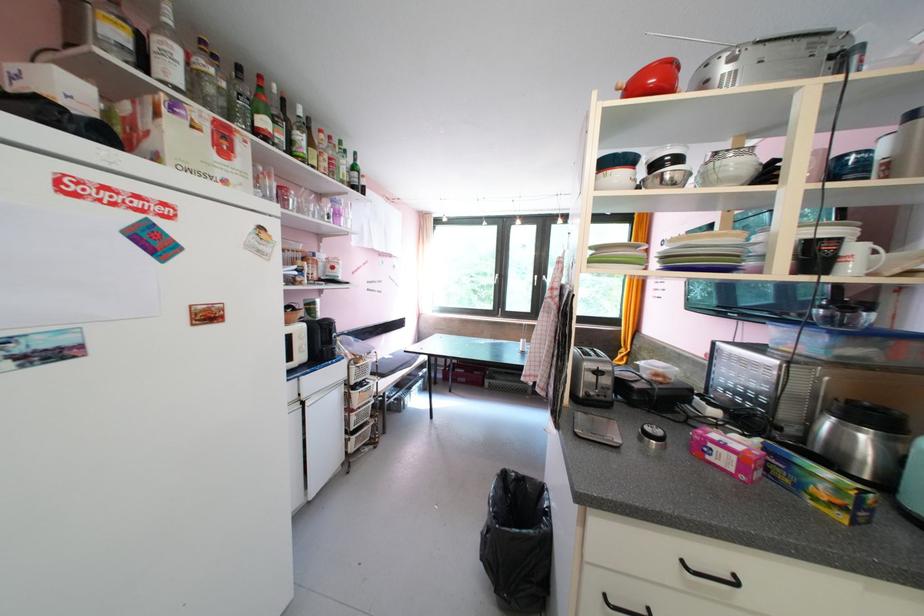
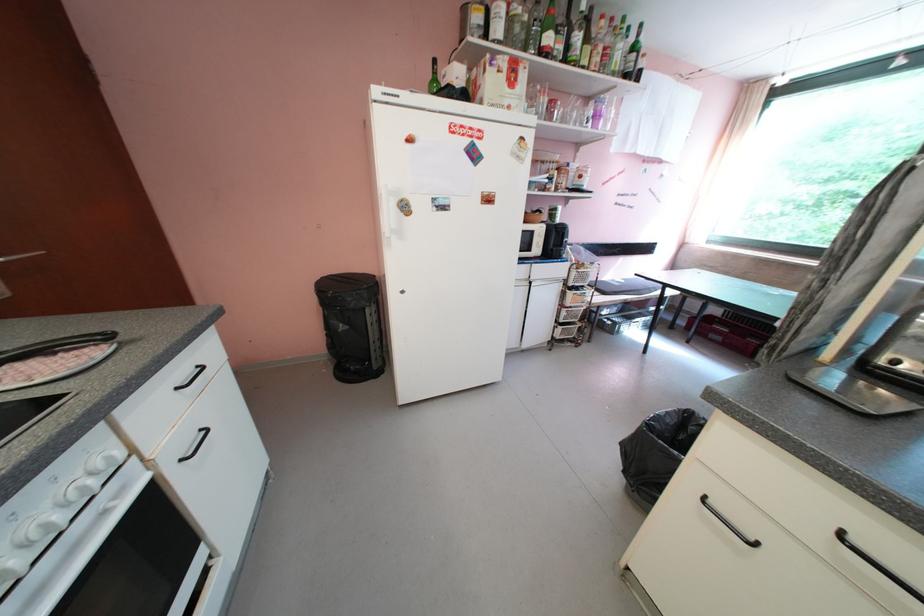
The point at (359, 390) is marked in the first image. Where is the corresponding point in the second image?

(576, 290)